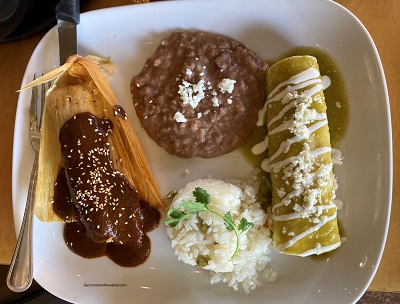
Locate an element on the screen. This screenshot has height=304, width=400. square white china plate is located at coordinates (362, 199), (60, 269), (319, 20).